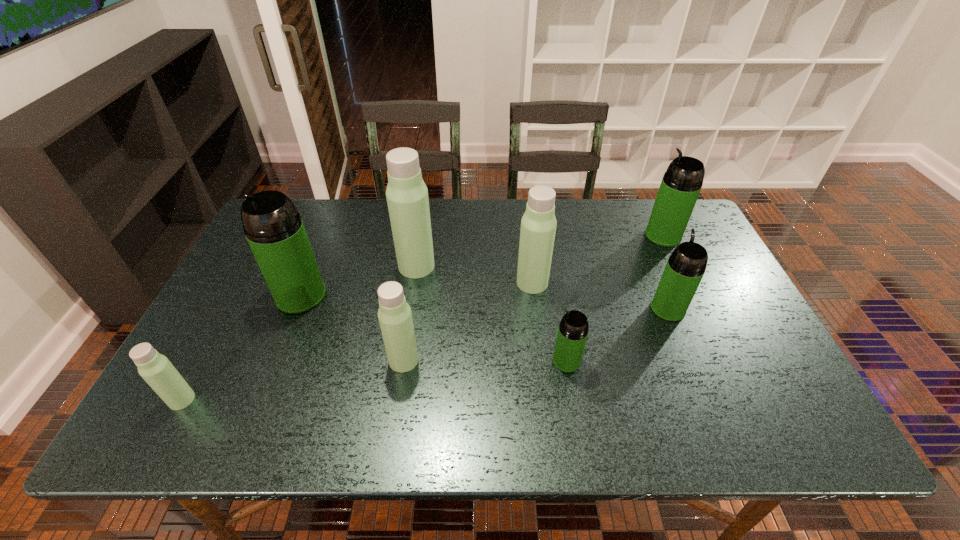
At what (x,y) coordinates should I click in order to perform the action: click on free region at the far edge of the desktop. Please return your answer as a coordinate pair (x, y). Looking at the image, I should click on (324, 239).

Identify the location of vacant space at the near edge of the desktop. (455, 423).

Find the location of a particular element. This screenshot has height=540, width=960. free space at the left edge of the desktop is located at coordinates click(192, 350).

Locate an element on the screen. vacant space at the right edge of the desktop is located at coordinates [x=768, y=346].

I want to click on free space at the far right corner, so click(x=645, y=206).

In the image, there is a desktop. At what (x,y) coordinates should I click in order to perform the action: click on vacant space at the near right corner. Please return your answer as a coordinate pair (x, y). Looking at the image, I should click on (759, 409).

I want to click on vacant space that is in between the farthest thermos bottle and the leftmost thermos bottle, so click(422, 318).

You are a GUI agent. You are given a task and a screenshot of the screen. Output one action in this format:
    pyautogui.click(x=<x>, y=<y>)
    Task: Click on the free point between the biggest green thermos bottle and the nearest green thermos bottle
    This screenshot has width=960, height=540.
    Given the screenshot: What is the action you would take?
    pyautogui.click(x=434, y=328)

Find the location of a particular element. Image resolution: width=960 pixels, height=540 pixels. vacant space in between the third farthest light thermos bottle and the second smallest green thermos bottle is located at coordinates (536, 335).

Where is `free spot between the nearest object and the second smallest light thermos bottle`? The width and height of the screenshot is (960, 540). free spot between the nearest object and the second smallest light thermos bottle is located at coordinates (293, 380).